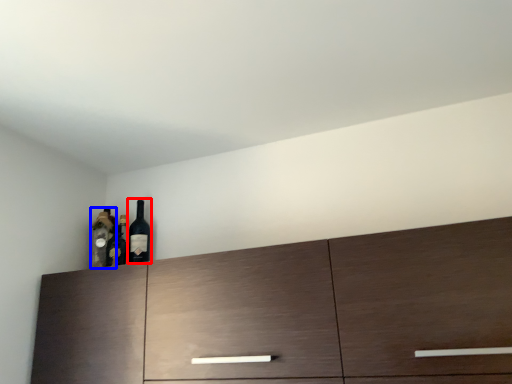
Question: Which object appears farthest to the camera in this image, wine bottle (highlighted by a red box) or bottle (highlighted by a blue box)?

Choices:
 (A) wine bottle
 (B) bottle

Answer: (B)